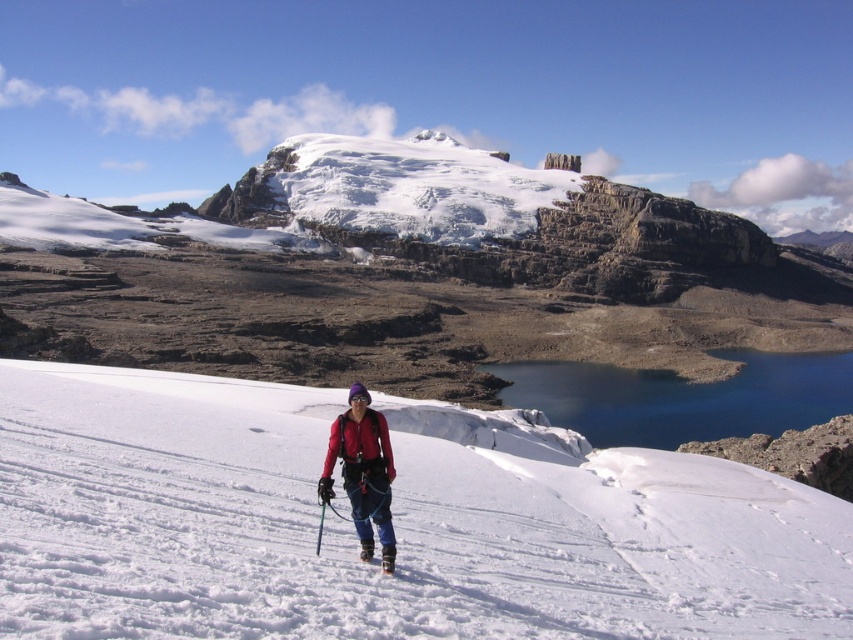
You are a photographer planning to take a photo of the white snow at center and the matte red jacket at center. Based on their positions, which object will appear closer to the camera in the photo?

The white snow at center appears closer to the camera because it is positioned in front of the matte red jacket at center in the scene.

You are standing at the point marked as point [165,406] in the image. You want to take a photo of the entire mountain landscape. Since the camera is 61.29 meters away from your current position, will you be able to capture the entire scene in one shot?

The camera is 61.29 meters away from point [165,406]. To capture the entire mountain landscape in one shot, you need to ensure that the camera can cover the entire scene from your current position. However, the distance alone doesn not guarantee the field of view. Without knowing the camera lens angle or sensor size, it is impossible to determine if the entire scene can be captured in one shot.